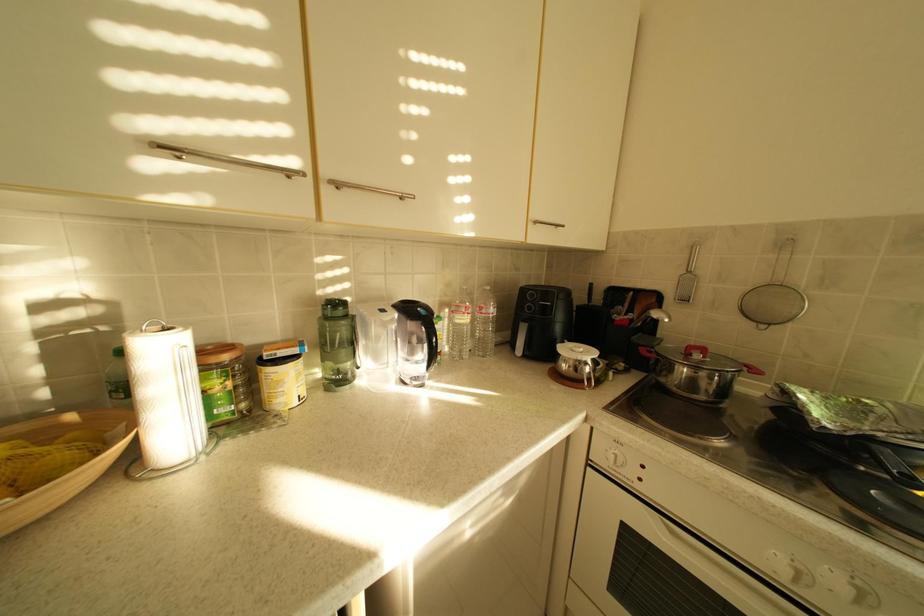
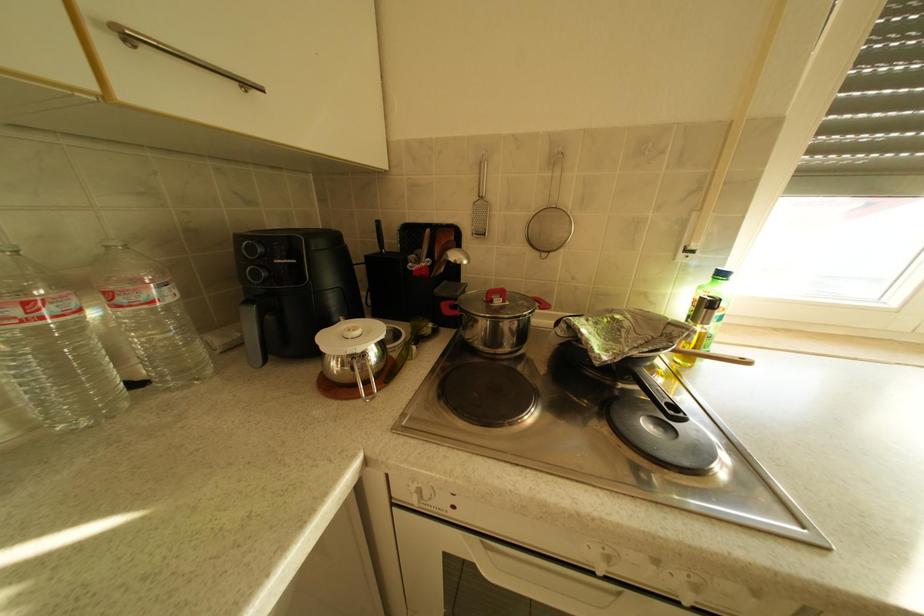
Question: The camera is either moving clockwise (left) or counter-clockwise (right) around the object. The first image is from the beginning of the video and the second image is from the end. Is the camera moving left or right when shooting the video?

Choices:
 (A) Left
 (B) Right

Answer: (A)